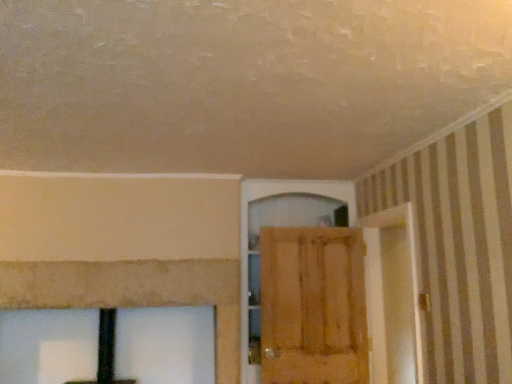
Question: Can you confirm if wooden door at center is positioned to the left of wooden screen door at right?

Choices:
 (A) no
 (B) yes

Answer: (B)

Question: Is the surface of wooden door at center in direct contact with wooden screen door at right?

Choices:
 (A) no
 (B) yes

Answer: (A)

Question: Does wooden door at center have a smaller size compared to wooden screen door at right?

Choices:
 (A) no
 (B) yes

Answer: (B)

Question: Considering the relative positions of wooden door at center and wooden screen door at right in the image provided, is wooden door at center to the right of wooden screen door at right from the viewer's perspective?

Choices:
 (A) no
 (B) yes

Answer: (A)

Question: Does wooden door at center have a larger size compared to wooden screen door at right?

Choices:
 (A) no
 (B) yes

Answer: (A)

Question: Is wooden door at center positioned behind wooden screen door at right?

Choices:
 (A) yes
 (B) no

Answer: (A)

Question: Is wooden screen door at right not close to wooden door at center?

Choices:
 (A) no
 (B) yes

Answer: (A)

Question: Can you confirm if wooden screen door at right is wider than wooden door at center?

Choices:
 (A) yes
 (B) no

Answer: (A)

Question: From a real-world perspective, is wooden screen door at right physically below wooden door at center?

Choices:
 (A) no
 (B) yes

Answer: (A)

Question: Is the position of wooden screen door at right less distant than that of wooden door at center?

Choices:
 (A) no
 (B) yes

Answer: (B)

Question: Is wooden screen door at right thinner than wooden door at center?

Choices:
 (A) no
 (B) yes

Answer: (A)

Question: Is wooden screen door at right looking in the opposite direction of wooden door at center?

Choices:
 (A) no
 (B) yes

Answer: (A)

Question: Do you think wooden screen door at right is within wooden door at center, or outside of it?

Choices:
 (A) inside
 (B) outside

Answer: (B)